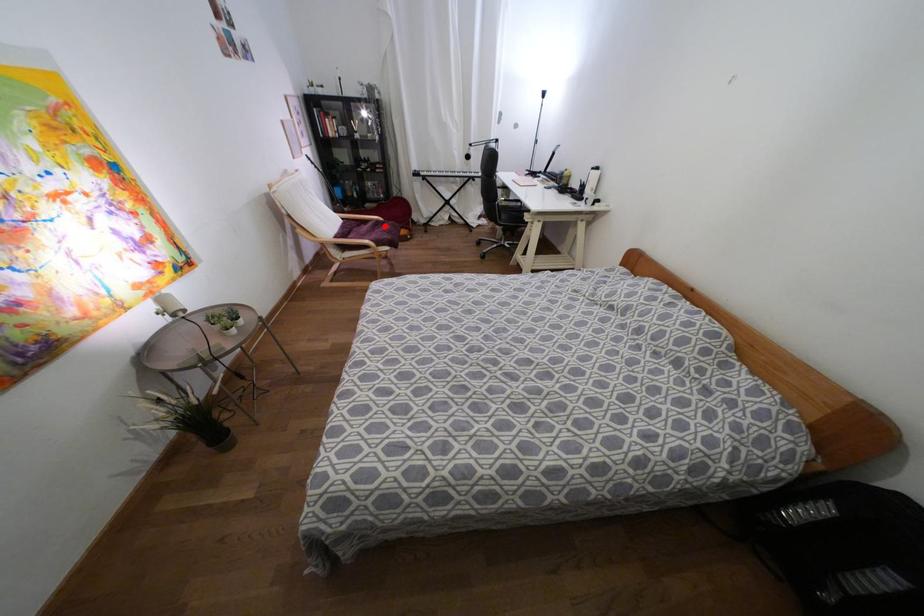
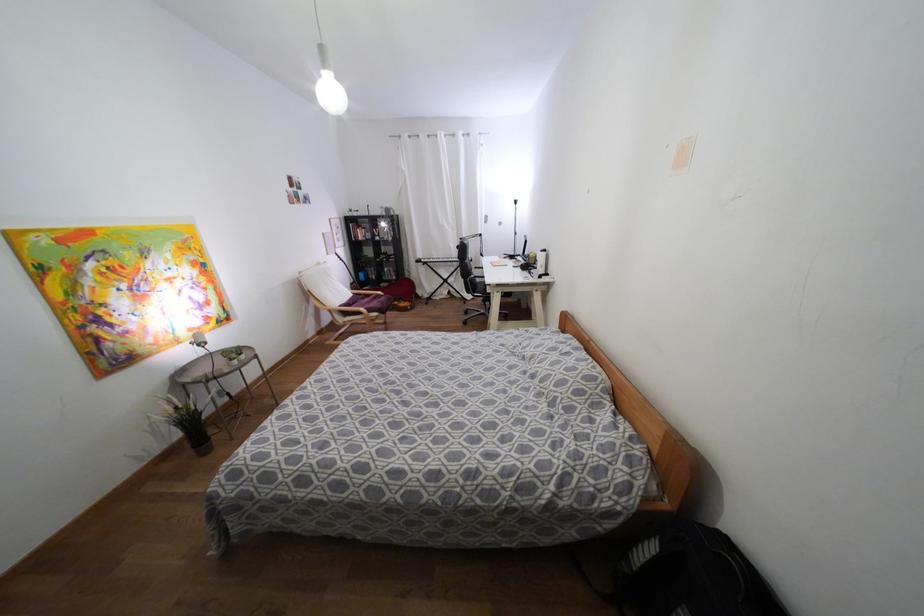
The point at the highlighted location is marked in the first image. Where is the corresponding point in the second image?

(382, 299)